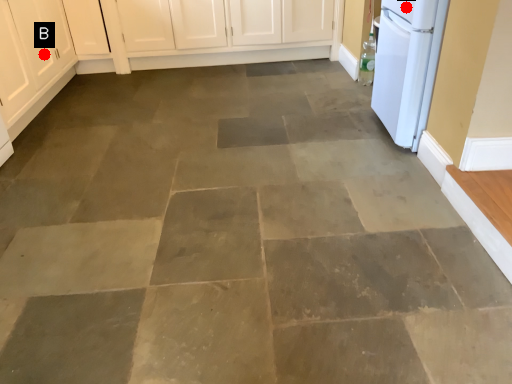
Question: Two points are circled on the image, labeled by A and B beside each circle. Which point is farther from the camera taking this photo?

Choices:
 (A) A is further
 (B) B is further

Answer: (B)